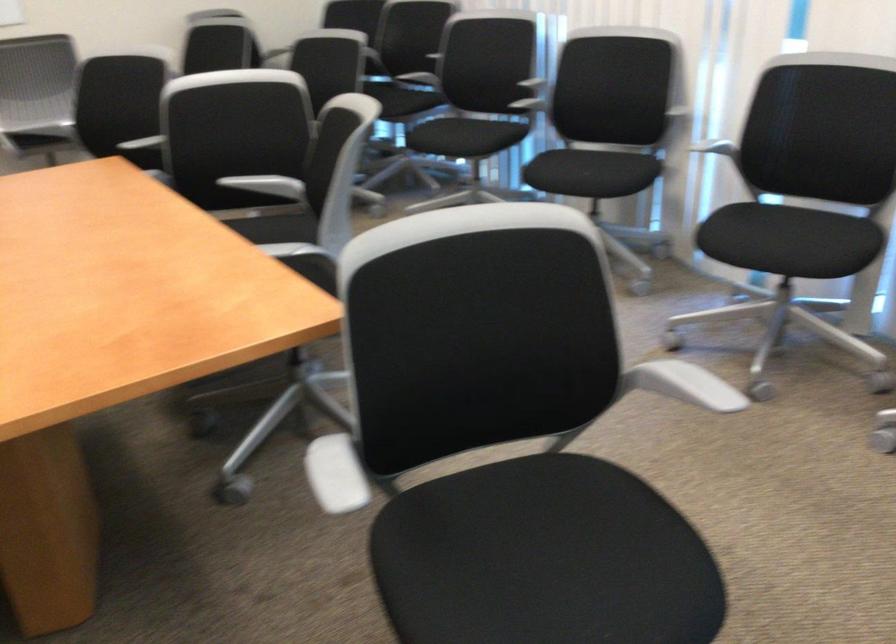
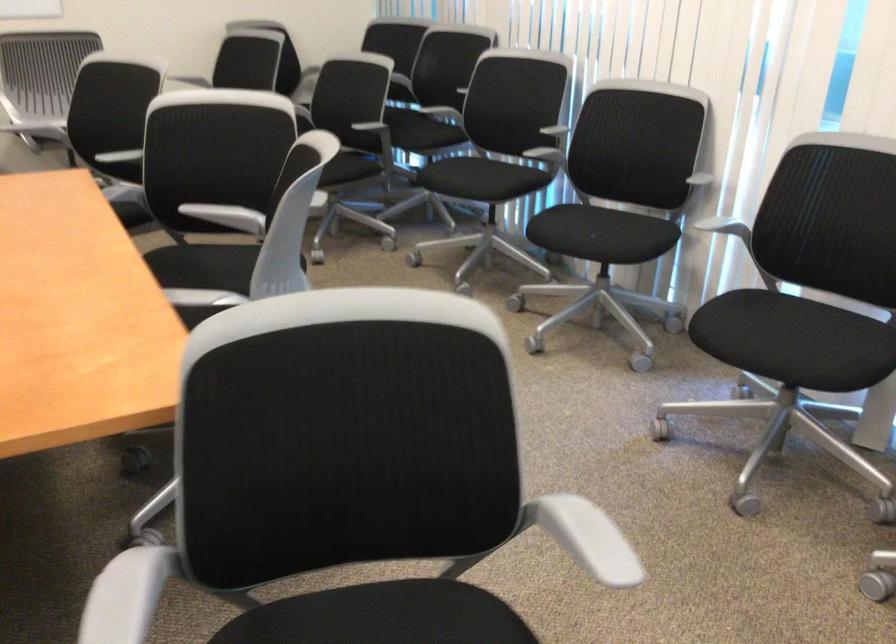
Question: The images are taken continuously from a first-person perspective. In which direction is your viewpoint rotating?

Choices:
 (A) Left
 (B) Right
 (C) Up
 (D) Down

Answer: (A)